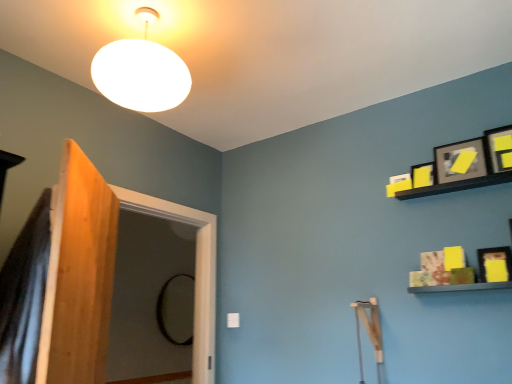
Question: Considering the relative positions of black glass mirror at center and yellow matte picture frame at upper right, positioned as the third picture frame in top-to-bottom order, in the image provided, is black glass mirror at center to the left of yellow matte picture frame at upper right, positioned as the third picture frame in top-to-bottom order, from the viewer's perspective?

Choices:
 (A) yes
 (B) no

Answer: (A)

Question: Is black glass mirror at center outside yellow matte picture frame at upper right, positioned as the third picture frame in top-to-bottom order?

Choices:
 (A) yes
 (B) no

Answer: (A)

Question: Is black glass mirror at center turned away from yellow matte picture frame at upper right, which ranks as the 2th picture frame in bottom-to-top order?

Choices:
 (A) no
 (B) yes

Answer: (A)

Question: Is black glass mirror at center beside yellow matte picture frame at upper right, which ranks as the 2th picture frame in bottom-to-top order?

Choices:
 (A) yes
 (B) no

Answer: (B)

Question: Is black glass mirror at center facing towards yellow matte picture frame at upper right, which ranks as the 2th picture frame in bottom-to-top order?

Choices:
 (A) yes
 (B) no

Answer: (B)

Question: From the image's perspective, does black glass mirror at center appear lower than yellow matte picture frame at upper right, which ranks as the 2th picture frame in bottom-to-top order?

Choices:
 (A) no
 (B) yes

Answer: (B)

Question: Is matte black picture frame at upper right, the 1th picture frame when ordered from bottom to top, thinner than matte black picture frame at upper right, which appears as the 2th picture frame when viewed from the top?

Choices:
 (A) yes
 (B) no

Answer: (A)

Question: Can you confirm if matte black picture frame at upper right, the 1th picture frame when ordered from bottom to top, is shorter than matte black picture frame at upper right, which appears as the 2th picture frame when viewed from the top?

Choices:
 (A) yes
 (B) no

Answer: (A)

Question: Is the depth of matte black picture frame at upper right, the 1th picture frame when ordered from bottom to top, greater than that of matte black picture frame at upper right, the third picture frame in the bottom-to-top sequence?

Choices:
 (A) yes
 (B) no

Answer: (B)

Question: Considering the relative positions of matte black picture frame at upper right, the 1th picture frame when ordered from bottom to top, and matte black picture frame at upper right, the third picture frame in the bottom-to-top sequence, in the image provided, is matte black picture frame at upper right, the 1th picture frame when ordered from bottom to top, in front of matte black picture frame at upper right, the third picture frame in the bottom-to-top sequence,?

Choices:
 (A) no
 (B) yes

Answer: (B)

Question: Can you confirm if matte black picture frame at upper right, the 1th picture frame when ordered from bottom to top, is taller than matte black picture frame at upper right, the third picture frame in the bottom-to-top sequence?

Choices:
 (A) no
 (B) yes

Answer: (A)

Question: Are matte black picture frame at upper right, the 1th picture frame when ordered from bottom to top, and matte black picture frame at upper right, which appears as the 2th picture frame when viewed from the top, located far from each other?

Choices:
 (A) no
 (B) yes

Answer: (A)

Question: Is matte black picture frame at upper right, the third picture frame in the bottom-to-top sequence, not inside matte black picture frame at upper right, which is counted as the 1th picture frame, starting from the top?

Choices:
 (A) yes
 (B) no

Answer: (A)